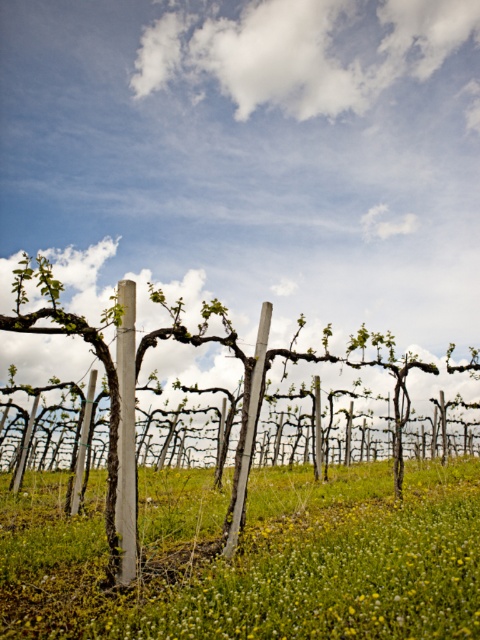
You are a farmer checking the vineyard. You see the green grassy at center and the wooden posts at center. Which one is located to the right of the other?

The green grassy at center is to the right of wooden posts at center according to the description.

You are standing at the entrance of the vineyard and see the point marked at coordinates (97, 356). What object is located at that point?

The green wood vine at center is located at point (97, 356).

You are a farmer inspecting the vineyard. You notice the green wood vine at center and the wooden posts at center. Which one takes up more space in the image?

The wooden posts at center take up more space than the green wood vine at center because the green wood vine at center occupies less space than wooden posts at center.